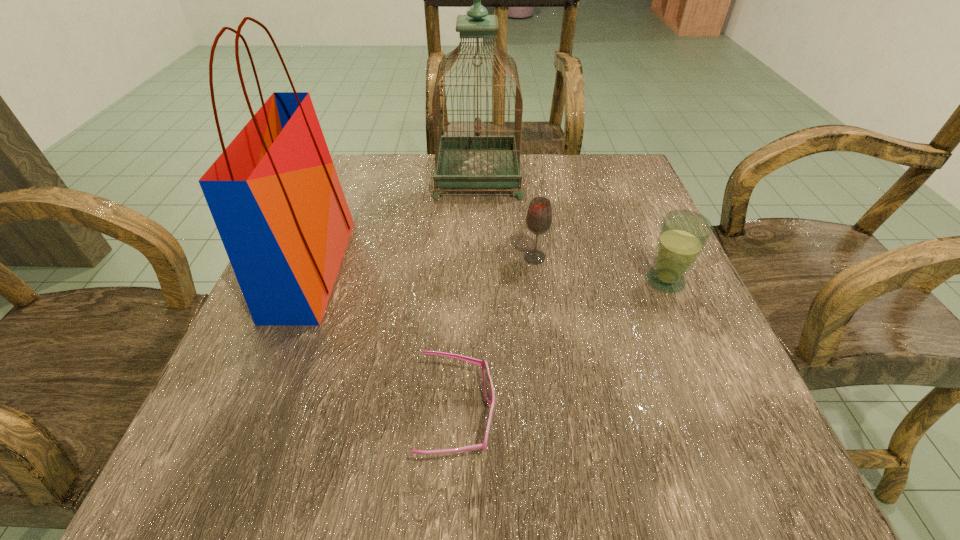
In the image, there is a desktop. At what (x,y) coordinates should I click in order to perform the action: click on vacant space at the far right corner. Please return your answer as a coordinate pair (x, y). The width and height of the screenshot is (960, 540). Looking at the image, I should click on (597, 210).

Identify the location of blank region between the shopping bag and the birdcage. (395, 222).

You are a GUI agent. You are given a task and a screenshot of the screen. Output one action in this format:
    pyautogui.click(x=<x>, y=<y>)
    Task: Click on the unoccupied position between the farthest object and the farther glass drink container
    Image resolution: width=960 pixels, height=540 pixels.
    Given the screenshot: What is the action you would take?
    pyautogui.click(x=506, y=217)

I want to click on free spot between the farther glass drink container and the shopping bag, so click(423, 263).

Locate an element on the screen. vacant point located between the nearest object and the farthest object is located at coordinates (468, 296).

You are a GUI agent. You are given a task and a screenshot of the screen. Output one action in this format:
    pyautogui.click(x=<x>, y=<y>)
    Task: Click on the free space that is in between the right glass drink container and the farther glass drink container
    This screenshot has width=960, height=540.
    Given the screenshot: What is the action you would take?
    pyautogui.click(x=600, y=269)

Where is `vacant area that lies between the nearest object and the shopping bag`? Image resolution: width=960 pixels, height=540 pixels. vacant area that lies between the nearest object and the shopping bag is located at coordinates [384, 342].

Where is `vacant region between the leftmost object and the right glass drink container`? vacant region between the leftmost object and the right glass drink container is located at coordinates (489, 275).

At what (x,y) coordinates should I click in order to perform the action: click on free space between the birdcage and the sunglasses. Please return your answer as a coordinate pair (x, y). Looking at the image, I should click on (468, 296).

The width and height of the screenshot is (960, 540). I want to click on free space between the rightmost object and the farthest object, so click(x=571, y=228).